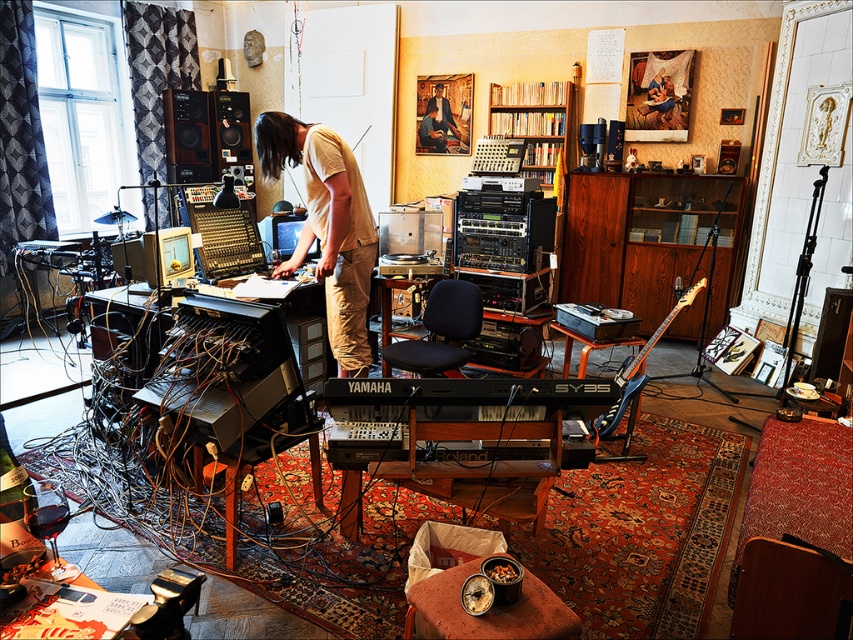
Question: Among these points, which one is nearest to the camera?

Choices:
 (A) (431, 115)
 (B) (561, 177)
 (C) (358, 330)
 (D) (634, 368)

Answer: (C)

Question: Does wooden speaker at upper left appear on the left side of light brown leather jacket at center?

Choices:
 (A) yes
 (B) no

Answer: (A)

Question: Considering the relative positions of black matte speaker at upper left and orange glossy electric guitar at right in the image provided, where is black matte speaker at upper left located with respect to orange glossy electric guitar at right?

Choices:
 (A) left
 (B) right

Answer: (A)

Question: Which object is positioned farthest from the wooden speaker at upper left?

Choices:
 (A) orange glossy electric guitar at right
 (B) light brown leather jacket at center

Answer: (A)

Question: Among these objects, which one is farthest from the camera?

Choices:
 (A) light beige cotton shirt at center
 (B) black matte speaker at upper left
 (C) light brown leather jacket at center

Answer: (B)

Question: Is wooden speaker at upper left further to the viewer compared to smooth beige shirt at center?

Choices:
 (A) yes
 (B) no

Answer: (A)